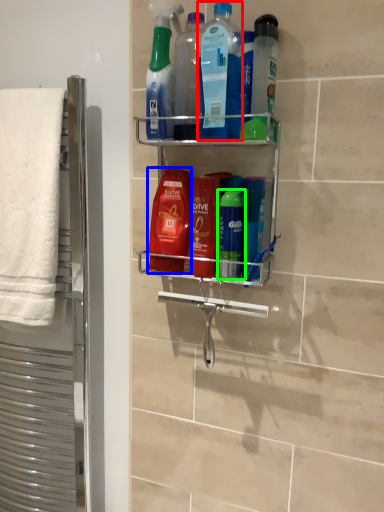
Question: Which object is the closest to the cleaning product (highlighted by a red box)? Choose among these: cleaning product (highlighted by a blue box) or mouthwash (highlighted by a green box).

Choices:
 (A) cleaning product
 (B) mouthwash

Answer: (A)